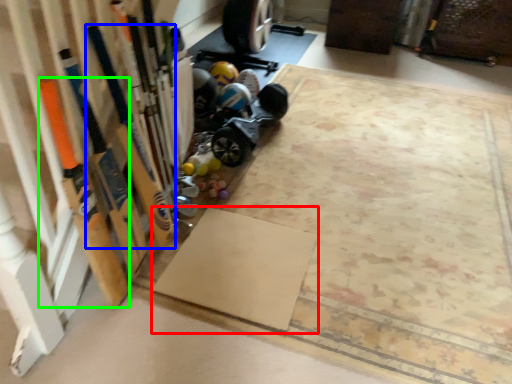
Question: Which object is the closest to the yoga mat (highlighted by a red box)? Choose among these: baseball bat (highlighted by a blue box) or baseball bat (highlighted by a green box).

Choices:
 (A) baseball bat
 (B) baseball bat

Answer: (A)